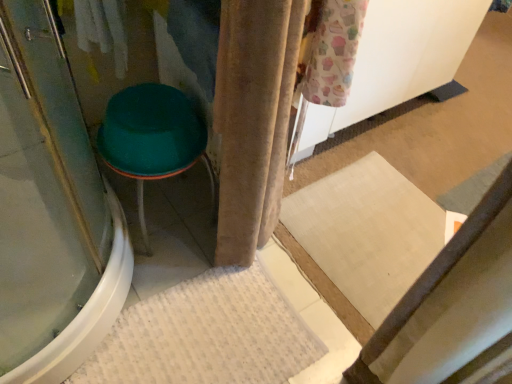
This screenshot has height=384, width=512. I want to click on free region under green plastic stool at left (from a real-world perspective), so click(172, 212).